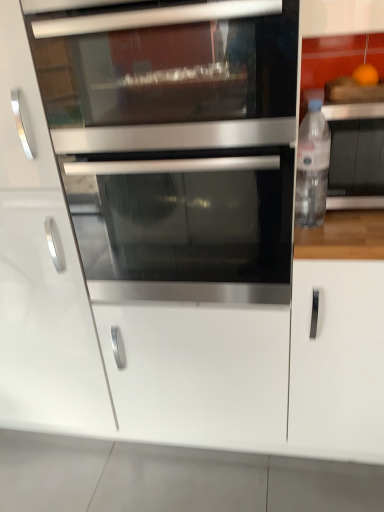
What do you see at coordinates (186, 226) in the screenshot? The width and height of the screenshot is (384, 512). I see `stainless steel oven at center` at bounding box center [186, 226].

Identify the location of clear plastic bottle at right. click(312, 167).

Describe the element at coordinates (198, 373) in the screenshot. Image resolution: width=384 pixels, height=512 pixels. I see `white matte drawer at center` at that location.

Where is `stainless steel oven at center`? The height and width of the screenshot is (512, 384). stainless steel oven at center is located at coordinates (186, 226).

Considering their positions, is clear plastic bottle at right located in front of or behind white matte drawer at center?

Visually, clear plastic bottle at right is located in front of white matte drawer at center.

Are clear plastic bottle at right and white matte drawer at center located far from each other?

They are positioned close to each other.

Which is more to the left, clear plastic bottle at right or white matte drawer at center?

Positioned to the left is white matte drawer at center.

Which is more distant, (340, 162) or (238, 375)?

Point (238, 375)

Which is behind, point (158, 118) or point (311, 205)?

The point (311, 205) is behind.

From a real-world perspective, is stainless steel microwave at center positioned above or below clear plastic bottle at right?

In terms of real-world spatial position, stainless steel microwave at center is above clear plastic bottle at right.

Locate an element on the screen. The width and height of the screenshot is (384, 512). microwave oven that appears in front of the clear plastic bottle at right is located at coordinates (168, 74).

Between stainless steel microwave at center and white matte drawer at center, which one is positioned in front?

stainless steel microwave at center.

Which is in front, point (203, 109) or point (154, 343)?

The point (203, 109) is more forward.

Is stainless steel microwave at center positioned with its back to white matte drawer at center?

No.

The height and width of the screenshot is (512, 384). Identify the location of microwave oven lying on the left of white matte drawer at center. (168, 74).

From a real-world perspective, is stainless steel microwave at center physically located above or below white glossy cabinet at center, the second cabinetry in the right-to-left sequence?

In terms of real-world spatial position, stainless steel microwave at center is above white glossy cabinet at center, the second cabinetry in the right-to-left sequence.

Which point is more forward, (129, 141) or (18, 412)?

The point (129, 141) is closer to the camera.

The image size is (384, 512). In order to click on cabinetry on the left of stainless steel microwave at center in this screenshot , I will do pos(40,272).

Considering the sizes of objects white glossy cabinet at center, placed as the first cabinetry when sorted from left to right, and stainless steel microwave at center in the image provided, who is wider, white glossy cabinet at center, placed as the first cabinetry when sorted from left to right, or stainless steel microwave at center?

Wider between the two is white glossy cabinet at center, placed as the first cabinetry when sorted from left to right.

Is white glossy cabinet at center, the second cabinetry in the right-to-left sequence, bigger than stainless steel microwave at center?

Indeed, white glossy cabinet at center, the second cabinetry in the right-to-left sequence, has a larger size compared to stainless steel microwave at center.

Considering the positions of objects white matte cabinet handle at right, marked as the second cabinetry in a left-to-right arrangement, and clear plastic bottle at right in the image provided, who is more to the right, white matte cabinet handle at right, marked as the second cabinetry in a left-to-right arrangement, or clear plastic bottle at right?

white matte cabinet handle at right, marked as the second cabinetry in a left-to-right arrangement.

From a real-world perspective, who is located lower, white matte cabinet handle at right, marked as the second cabinetry in a left-to-right arrangement, or clear plastic bottle at right?

white matte cabinet handle at right, marked as the second cabinetry in a left-to-right arrangement.

Does white matte cabinet handle at right, marked as the second cabinetry in a left-to-right arrangement, lie in front of clear plastic bottle at right?

Yes, the depth of white matte cabinet handle at right, marked as the second cabinetry in a left-to-right arrangement, is less than that of clear plastic bottle at right.

Is white matte cabinet handle at right, marked as the second cabinetry in a left-to-right arrangement, situated inside clear plastic bottle at right or outside?

white matte cabinet handle at right, marked as the second cabinetry in a left-to-right arrangement, exists outside the volume of clear plastic bottle at right.

Can you confirm if clear plastic bottle at right is wider than stainless steel microwave at center?

No.

Is clear plastic bottle at right facing away from stainless steel microwave at center?

clear plastic bottle at right is not turned away from stainless steel microwave at center.

Between clear plastic bottle at right and stainless steel microwave at center, which one appears on the left side from the viewer's perspective?

From the viewer's perspective, stainless steel microwave at center appears more on the left side.

In the image, there is a clear plastic bottle at right. In order to click on drawer below it (from the image's perspective) in this screenshot , I will do `click(198, 373)`.

Image resolution: width=384 pixels, height=512 pixels. What are the coordinates of `bottle below the stainless steel microwave at center (from a real-world perspective)` in the screenshot? It's located at (312, 167).

When comparing their distances from stainless steel oven at center, does clear plastic bottle at right or stainless steel microwave at center seem closer?

Among the two, stainless steel microwave at center is located nearer to stainless steel oven at center.

Looking at this image, which object lies further to the anchor point stainless steel oven at center, white matte cabinet handle at right, marked as the second cabinetry in a left-to-right arrangement, or white glossy cabinet at center, the second cabinetry in the right-to-left sequence?

white matte cabinet handle at right, marked as the second cabinetry in a left-to-right arrangement, is positioned further to the anchor stainless steel oven at center.

From the image, which object appears to be farther from clear plastic bottle at right, clear plastic bottle at right or stainless steel oven at center?

The object further to clear plastic bottle at right is stainless steel oven at center.

Considering their positions, is clear plastic bottle at right positioned closer to clear plastic bottle at right than white matte cabinet handle at right, which is the 1th cabinetry in right-to-left order?

clear plastic bottle at right lies closer to clear plastic bottle at right than the other object.

When comparing their distances from stainless steel microwave at center, does white matte cabinet handle at right, marked as the second cabinetry in a left-to-right arrangement, or clear plastic bottle at right seem further?

white matte cabinet handle at right, marked as the second cabinetry in a left-to-right arrangement, lies further to stainless steel microwave at center than the other object.

When comparing their distances from clear plastic bottle at right, does clear plastic bottle at right or white matte cabinet handle at right, which is the 1th cabinetry in right-to-left order, seem closer?

clear plastic bottle at right is closer to clear plastic bottle at right.

Based on their spatial positions, is white matte drawer at center or clear plastic bottle at right closer to white matte cabinet handle at right, which is the 1th cabinetry in right-to-left order?

Among the two, white matte drawer at center is located nearer to white matte cabinet handle at right, which is the 1th cabinetry in right-to-left order.

Based on the photo, when comparing their distances from white matte cabinet handle at right, marked as the second cabinetry in a left-to-right arrangement, does white glossy cabinet at center, the second cabinetry in the right-to-left sequence, or clear plastic bottle at right seem further?

The object further to white matte cabinet handle at right, marked as the second cabinetry in a left-to-right arrangement, is white glossy cabinet at center, the second cabinetry in the right-to-left sequence.

What are the coordinates of `bottle located between stainless steel oven at center and white matte cabinet handle at right, marked as the second cabinetry in a left-to-right arrangement, in the left-right direction` in the screenshot? It's located at (312, 167).

Locate an element on the screen. oven between white glossy cabinet at center, the second cabinetry in the right-to-left sequence, and clear plastic bottle at right from left to right is located at coordinates (186, 226).

You are a GUI agent. You are given a task and a screenshot of the screen. Output one action in this format:
    pyautogui.click(x=<x>, y=<y>)
    Task: Click on the oven situated between white glossy cabinet at center, placed as the first cabinetry when sorted from left to right, and white matte drawer at center from left to right
    This screenshot has width=384, height=512.
    Given the screenshot: What is the action you would take?
    pyautogui.click(x=186, y=226)

The height and width of the screenshot is (512, 384). I want to click on oven that lies between clear plastic bottle at right and white matte drawer at center from top to bottom, so click(x=186, y=226).